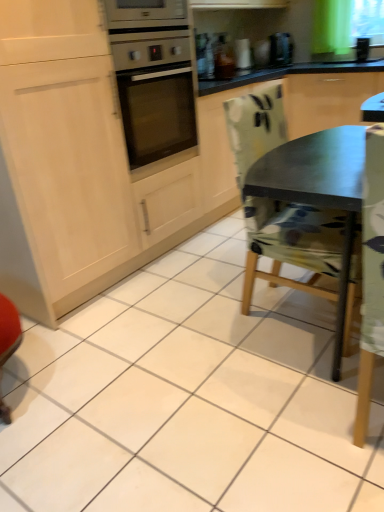
Question: Is camouflage fabric chair at center closer to camera compared to metallic silver toaster at upper center?

Choices:
 (A) yes
 (B) no

Answer: (A)

Question: Is camouflage fabric chair at center wider than metallic silver toaster at upper center?

Choices:
 (A) no
 (B) yes

Answer: (B)

Question: Can you confirm if camouflage fabric chair at center is bigger than metallic silver toaster at upper center?

Choices:
 (A) no
 (B) yes

Answer: (B)

Question: Considering the relative positions of camouflage fabric chair at center and metallic silver toaster at upper center in the image provided, is camouflage fabric chair at center to the left of metallic silver toaster at upper center from the viewer's perspective?

Choices:
 (A) no
 (B) yes

Answer: (A)

Question: From the image's perspective, is camouflage fabric chair at center on metallic silver toaster at upper center?

Choices:
 (A) yes
 (B) no

Answer: (B)

Question: In terms of height, does black plastic coffee machine at upper center look taller or shorter compared to camouflage fabric chair at center?

Choices:
 (A) short
 (B) tall

Answer: (A)

Question: Based on their positions, is black plastic coffee machine at upper center located to the left or right of camouflage fabric chair at center?

Choices:
 (A) right
 (B) left

Answer: (A)

Question: Would you say black plastic coffee machine at upper center is inside or outside camouflage fabric chair at center?

Choices:
 (A) inside
 (B) outside

Answer: (B)

Question: Relative to camouflage fabric chair at center, is black plastic coffee machine at upper center in front or behind?

Choices:
 (A) front
 (B) behind

Answer: (B)

Question: Looking at their shapes, would you say camouflage fabric chair at center is wider or thinner than black plastic coffee machine at upper center?

Choices:
 (A) wide
 (B) thin

Answer: (A)

Question: In the image, is camouflage fabric chair at center positioned in front of or behind black plastic coffee machine at upper center?

Choices:
 (A) front
 (B) behind

Answer: (A)

Question: Considering the relative positions of camouflage fabric chair at center and black plastic coffee machine at upper center in the image provided, is camouflage fabric chair at center to the left or to the right of black plastic coffee machine at upper center?

Choices:
 (A) right
 (B) left

Answer: (B)

Question: Is point (302, 257) positioned closer to the camera than point (288, 33)?

Choices:
 (A) farther
 (B) closer

Answer: (B)

Question: Considering the positions of metallic silver toaster at upper center and camouflage fabric chair at center in the image, is metallic silver toaster at upper center taller or shorter than camouflage fabric chair at center?

Choices:
 (A) short
 (B) tall

Answer: (A)

Question: Relative to camouflage fabric chair at center, is metallic silver toaster at upper center in front or behind?

Choices:
 (A) front
 (B) behind

Answer: (B)